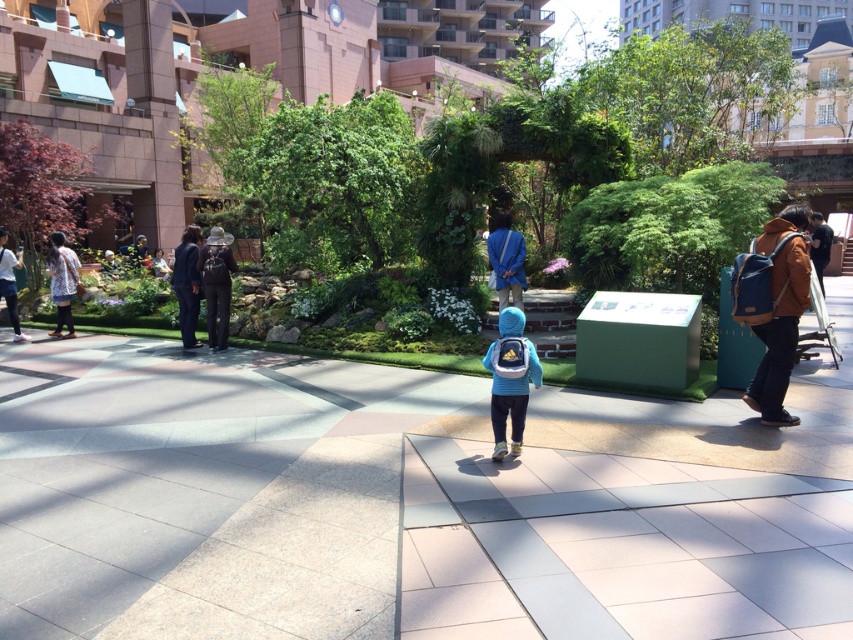
Who is taller, matte white jacket at left or light blue fabric jacket at center?

matte white jacket at left

Is matte white jacket at left smaller than light blue fabric jacket at center?

No.

Find the location of `matte white jacket at left`. matte white jacket at left is located at coordinates (9, 282).

Is smooth concrete path at center taller than dark blue fabric coat at left?

No, smooth concrete path at center is not taller than dark blue fabric coat at left.

Does smooth concrete path at center appear on the left side of dark blue fabric coat at left?

Incorrect, smooth concrete path at center is not on the left side of dark blue fabric coat at left.

Describe the element at coordinates (405, 502) in the screenshot. This screenshot has width=853, height=640. I see `smooth concrete path at center` at that location.

This screenshot has width=853, height=640. Identify the location of smooth concrete path at center. (405, 502).

Between brown canvas backpack at right and light blue fabric jacket at center, which one has less height?

With less height is light blue fabric jacket at center.

Can you confirm if brown canvas backpack at right is bigger than light blue fabric jacket at center?

Yes, brown canvas backpack at right is bigger than light blue fabric jacket at center.

Who is more distant from viewer, (x=773, y=236) or (x=155, y=268)?

The point (x=155, y=268) is more distant.

The height and width of the screenshot is (640, 853). I want to click on brown canvas backpack at right, so click(780, 333).